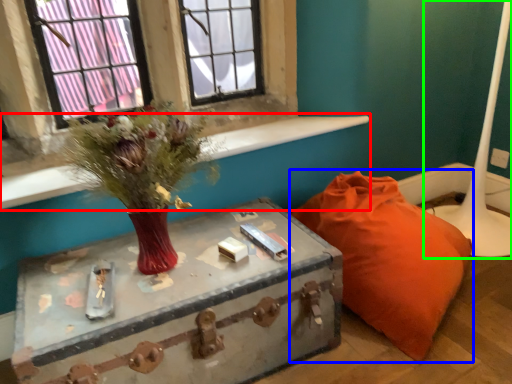
Question: Considering the real-world distances, which object is closest to window sill (highlighted by a red box)? furniture (highlighted by a blue box) or table lamp (highlighted by a green box).

Choices:
 (A) furniture
 (B) table lamp

Answer: (A)